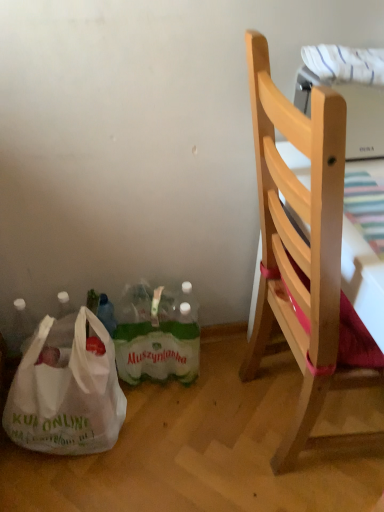
Where is `free location to the left of natural wood chair at right`? free location to the left of natural wood chair at right is located at coordinates (188, 433).